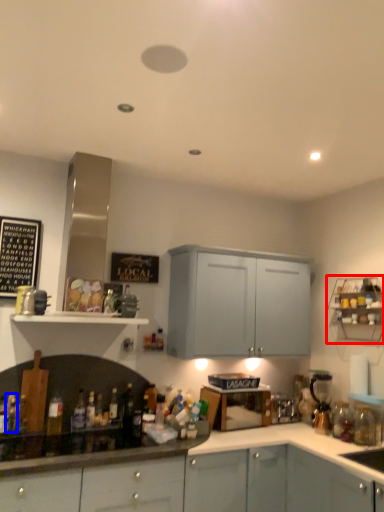
Question: Which point is further to the camera, shelf (highlighted by a red box) or bottle (highlighted by a blue box)?

Choices:
 (A) shelf
 (B) bottle

Answer: (A)